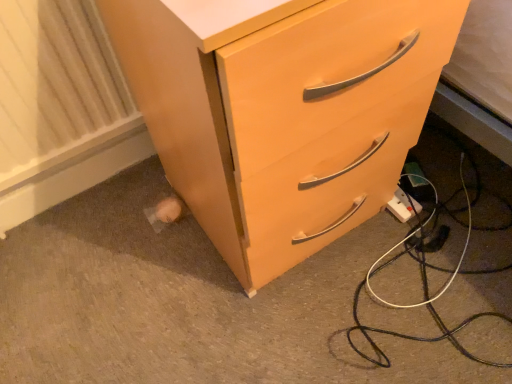
Question: Considering the relative positions of matte wood chest of drawers at center and white textured radiator at lower left in the image provided, is matte wood chest of drawers at center to the right of white textured radiator at lower left from the viewer's perspective?

Choices:
 (A) no
 (B) yes

Answer: (B)

Question: From the image's perspective, is matte wood chest of drawers at center located beneath white textured radiator at lower left?

Choices:
 (A) no
 (B) yes

Answer: (A)

Question: Is matte wood chest of drawers at center at the left side of white textured radiator at lower left?

Choices:
 (A) yes
 (B) no

Answer: (B)

Question: Considering the relative sizes of matte wood chest of drawers at center and white textured radiator at lower left in the image provided, is matte wood chest of drawers at center wider than white textured radiator at lower left?

Choices:
 (A) no
 (B) yes

Answer: (B)

Question: From a real-world perspective, is matte wood chest of drawers at center on white textured radiator at lower left?

Choices:
 (A) no
 (B) yes

Answer: (B)

Question: Does matte wood chest of drawers at center have a greater height compared to white textured radiator at lower left?

Choices:
 (A) yes
 (B) no

Answer: (A)

Question: Is matte wood chest of drawers at center located outside white plastic power strip at lower right?

Choices:
 (A) yes
 (B) no

Answer: (A)

Question: From the image's perspective, is matte wood chest of drawers at center on top of white plastic power strip at lower right?

Choices:
 (A) yes
 (B) no

Answer: (A)

Question: From a real-world perspective, is matte wood chest of drawers at center over white plastic power strip at lower right?

Choices:
 (A) yes
 (B) no

Answer: (A)

Question: Does matte wood chest of drawers at center have a greater height compared to white plastic power strip at lower right?

Choices:
 (A) yes
 (B) no

Answer: (A)

Question: Does matte wood chest of drawers at center come behind white plastic power strip at lower right?

Choices:
 (A) yes
 (B) no

Answer: (B)

Question: Is matte wood chest of drawers at center in front of white plastic power strip at lower right?

Choices:
 (A) yes
 (B) no

Answer: (A)

Question: Is white plastic power strip at lower right smaller than matte wood chest of drawers at center?

Choices:
 (A) yes
 (B) no

Answer: (A)